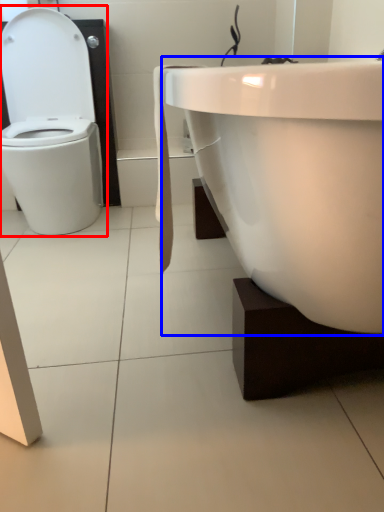
Question: Which object appears farthest to the camera in this image, toilet (highlighted by a red box) or sink (highlighted by a blue box)?

Choices:
 (A) toilet
 (B) sink

Answer: (A)